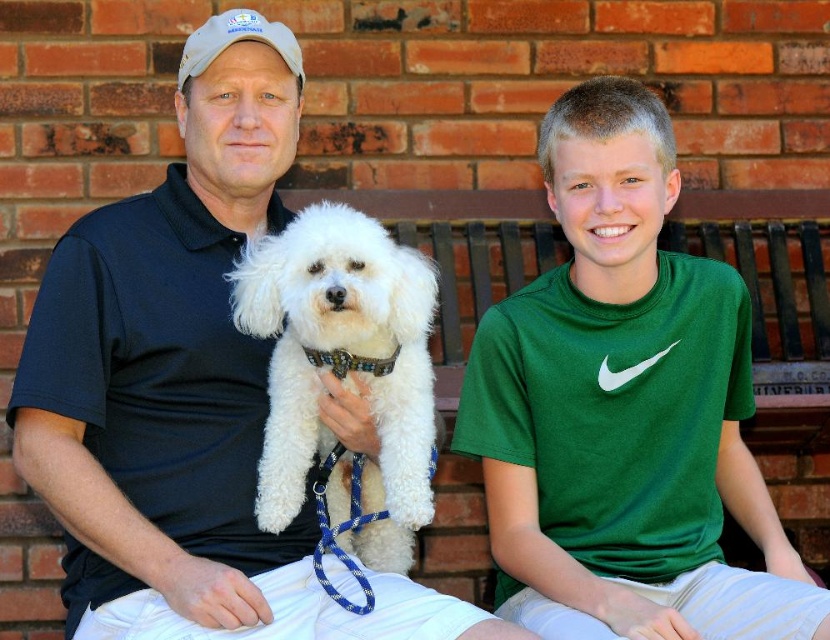
Question: Which object is closer to the camera taking this photo?

Choices:
 (A) green cotton shirt at center
 (B) matte black shirt at center
 (C) white fluffy dog at center

Answer: (C)

Question: Is matte black shirt at center wider than white fluffy dog at center?

Choices:
 (A) no
 (B) yes

Answer: (B)

Question: Does matte black shirt at center appear on the right side of green cotton shirt at center?

Choices:
 (A) no
 (B) yes

Answer: (A)

Question: Can you confirm if matte black shirt at center is wider than green cotton shirt at center?

Choices:
 (A) no
 (B) yes

Answer: (B)

Question: Estimate the real-world distances between objects in this image. Which object is closer to the matte black shirt at center?

Choices:
 (A) white fluffy dog at center
 (B) green cotton shirt at center

Answer: (A)

Question: Which of the following is the farthest from the observer?

Choices:
 (A) matte black shirt at center
 (B) green cotton shirt at center
 (C) white fluffy dog at center

Answer: (B)